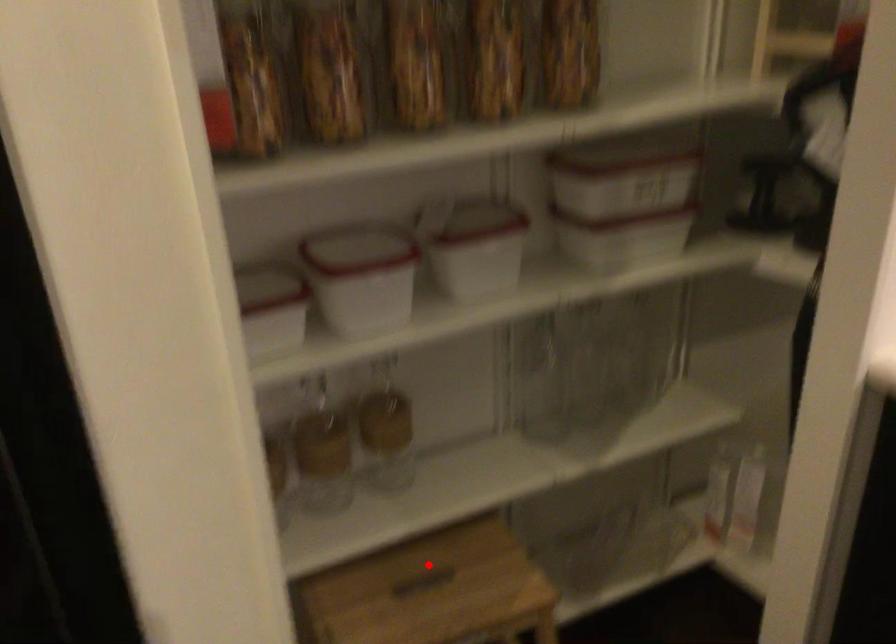
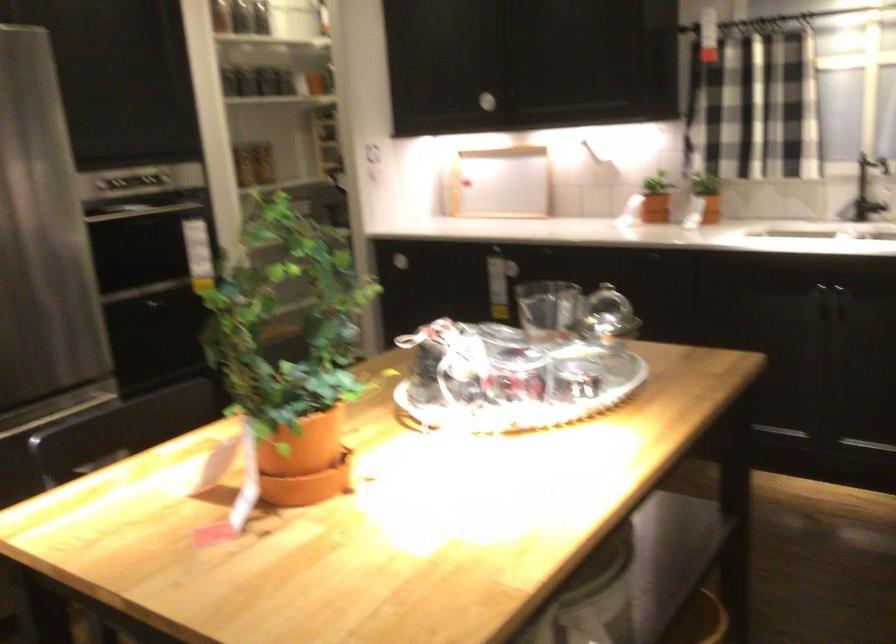
Question: I am providing you with two images of the same scene from different viewpoints. A red point is marked on the first image. At the location where the point appears in image 1, is it still visible in image 2?

Choices:
 (A) Yes
 (B) No

Answer: (B)